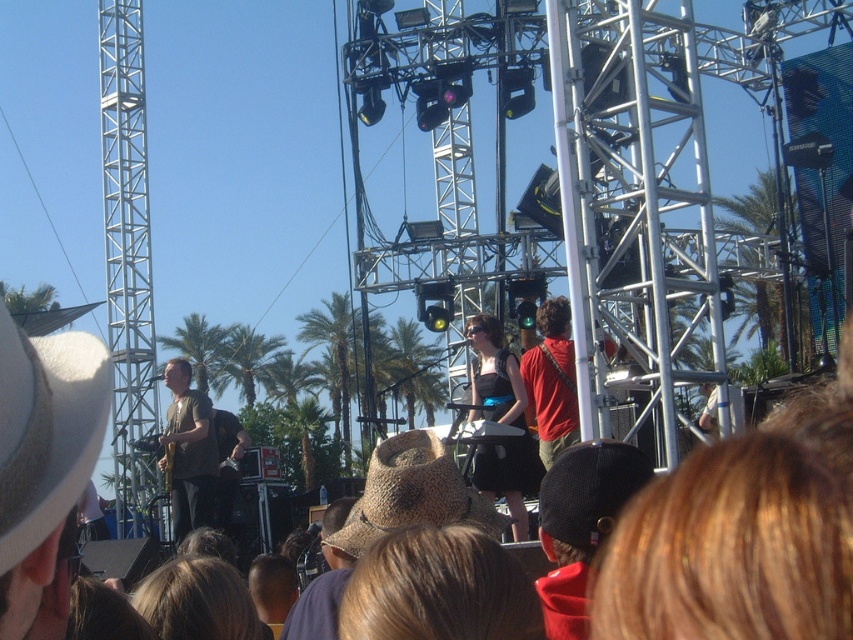
You are a photographer at the concert and want to capture both the black satin dress at center and the black mesh cap at center in a single shot. Which object should you focus on first to ensure both are in frame?

The black satin dress at center is bigger than the black mesh cap at center, so you should focus on the black satin dress at center first to ensure both are in frame.

You are standing at the concert and want to take a photo of both the point at coordinates (494, 376) and the point at coordinates (628, 490). Since you want both points to be in focus, which point should you focus on first to ensure depth of field?

You should focus on the point at coordinates (494, 376) first because it is closer to the camera than the point at coordinates (628, 490). This ensures that both points will be within the depth of field when using appropriate settings.